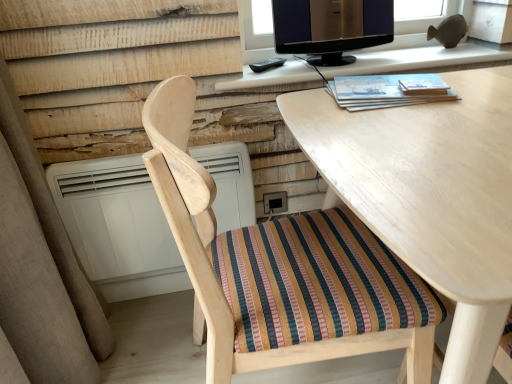
Where is `vacant point to the right of black glossy monitor at upper center`? vacant point to the right of black glossy monitor at upper center is located at coordinates (409, 53).